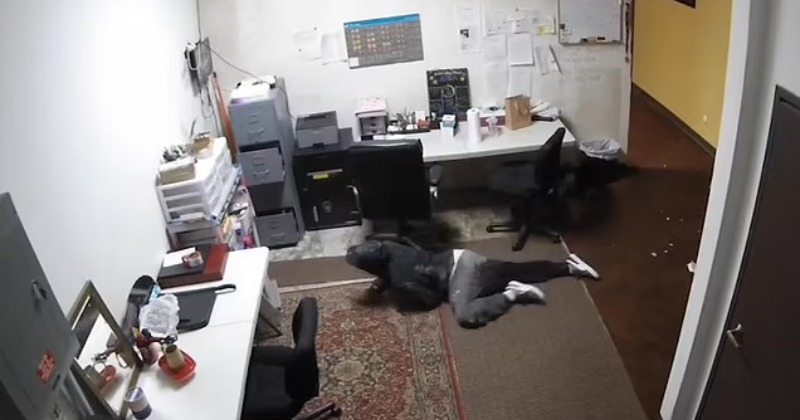
The width and height of the screenshot is (800, 420). I want to click on office chair, so click(530, 187), click(368, 166).